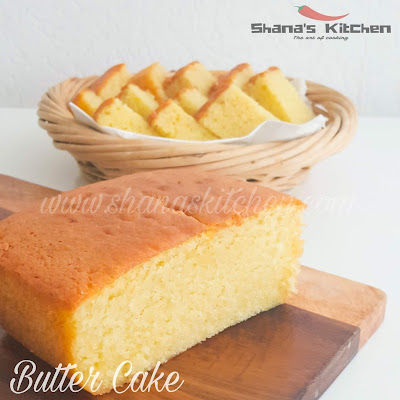
Where is `light and dark wooden cutting board`? This screenshot has width=400, height=400. light and dark wooden cutting board is located at coordinates (275, 368), (337, 300).